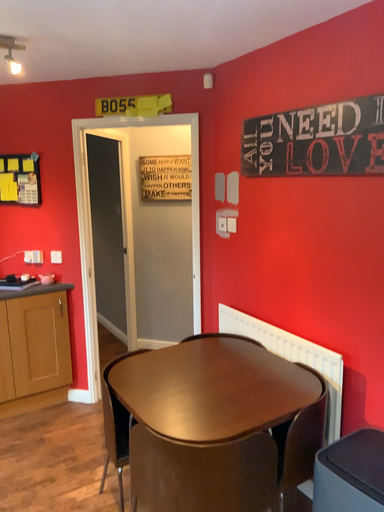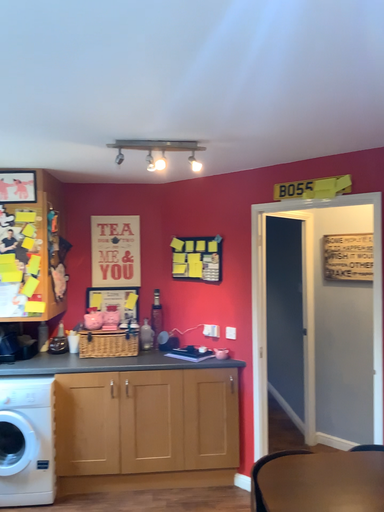
Question: Which way did the camera rotate in the video?

Choices:
 (A) rotated right
 (B) rotated left

Answer: (B)